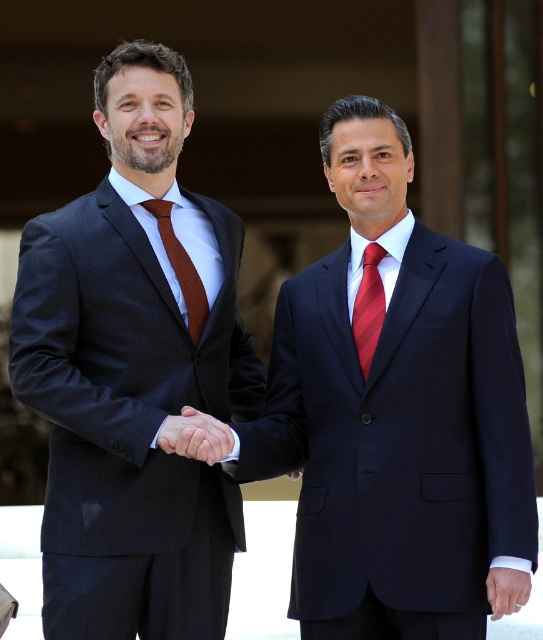
Looking at this image, does matte black suit at left have a greater width compared to smooth skin handshake at center?

Correct, the width of matte black suit at left exceeds that of smooth skin handshake at center.

Between matte black suit at left and smooth skin handshake at center, which one appears on the right side from the viewer's perspective?

Positioned to the right is smooth skin handshake at center.

Is point (128, 259) more distant than point (187, 426)?

Yes, point (128, 259) is farther from viewer.

You are a GUI agent. You are given a task and a screenshot of the screen. Output one action in this format:
    pyautogui.click(x=<x>, y=<y>)
    Task: Click on the matte black suit at left
    The image size is (543, 640).
    Given the screenshot: What is the action you would take?
    pyautogui.click(x=135, y=372)

Which is in front, point (46, 632) or point (188, 276)?

Point (46, 632) is in front.

Is matte black suit at left above brown silk tie at center?

No.

Is point (116, 508) positioned in front of point (161, 205)?

That is True.

Where is `matte black suit at left`? Image resolution: width=543 pixels, height=640 pixels. matte black suit at left is located at coordinates (135, 372).

Between smooth skin handshake at center and brown silk tie at center, which one appears on the left side from the viewer's perspective?

brown silk tie at center

Is smooth skin handshake at center above brown silk tie at center?

Incorrect, smooth skin handshake at center is not positioned above brown silk tie at center.

Image resolution: width=543 pixels, height=640 pixels. What do you see at coordinates (195, 436) in the screenshot? I see `smooth skin handshake at center` at bounding box center [195, 436].

At what (x,y) coordinates should I click in order to perform the action: click on smooth skin handshake at center. Please return your answer as a coordinate pair (x, y). Looking at the image, I should click on (195, 436).